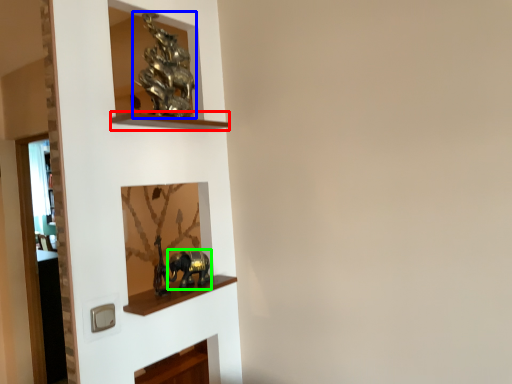
Question: Which object is the closest to the cabinet (highlighted by a red box)? Choose among these: art (highlighted by a blue box) or art (highlighted by a green box).

Choices:
 (A) art
 (B) art

Answer: (A)